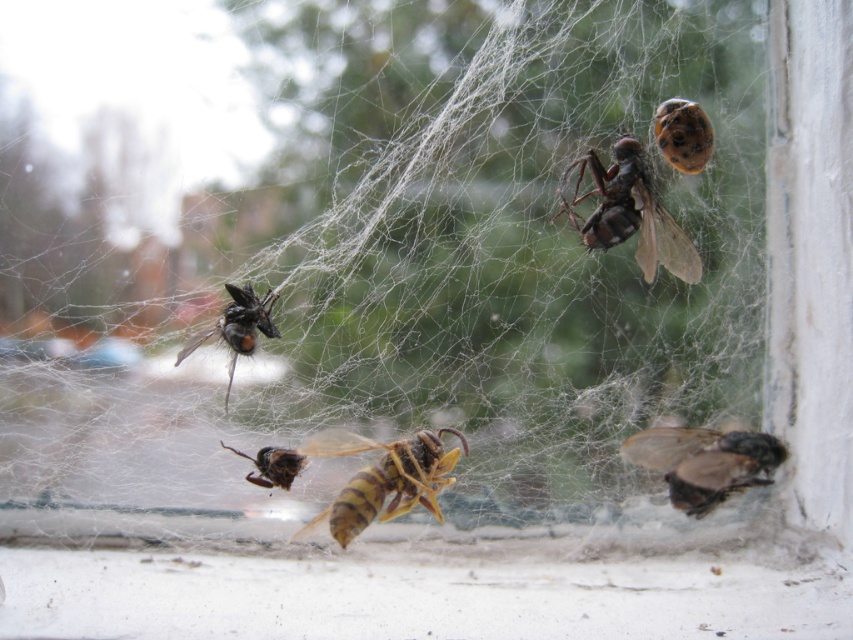
Which is more to the right, yellow striped wasp at center or brown fuzzy bee at lower right?

From the viewer's perspective, brown fuzzy bee at lower right appears more on the right side.

Between point (438, 444) and point (726, 451), which one is positioned in front?

Positioned in front is point (726, 451).

Locate an element on the screen. yellow striped wasp at center is located at coordinates (381, 477).

Can you confirm if shiny black fly at left is positioned above brown fuzzy bee at center?

Indeed, shiny black fly at left is positioned over brown fuzzy bee at center.

Find the location of a particular element. shiny black fly at left is located at coordinates (x=236, y=326).

Is point (445, 454) positioned after point (274, 480)?

Yes, point (445, 454) is behind point (274, 480).

Does yellow striped wasp at center have a lesser height compared to brown fuzzy bee at center?

No.

Is point (363, 522) positioned in front of point (283, 484)?

Yes, point (363, 522) is closer to viewer.

Where is `yellow striped wasp at center`? Image resolution: width=853 pixels, height=640 pixels. yellow striped wasp at center is located at coordinates (381, 477).